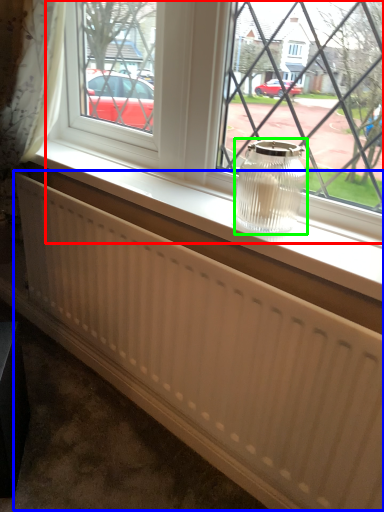
Question: Which object is positioned closest to window (highlighted by a red box)? Select from radiator (highlighted by a blue box) and glass vase (highlighted by a green box).

Choices:
 (A) radiator
 (B) glass vase

Answer: (B)